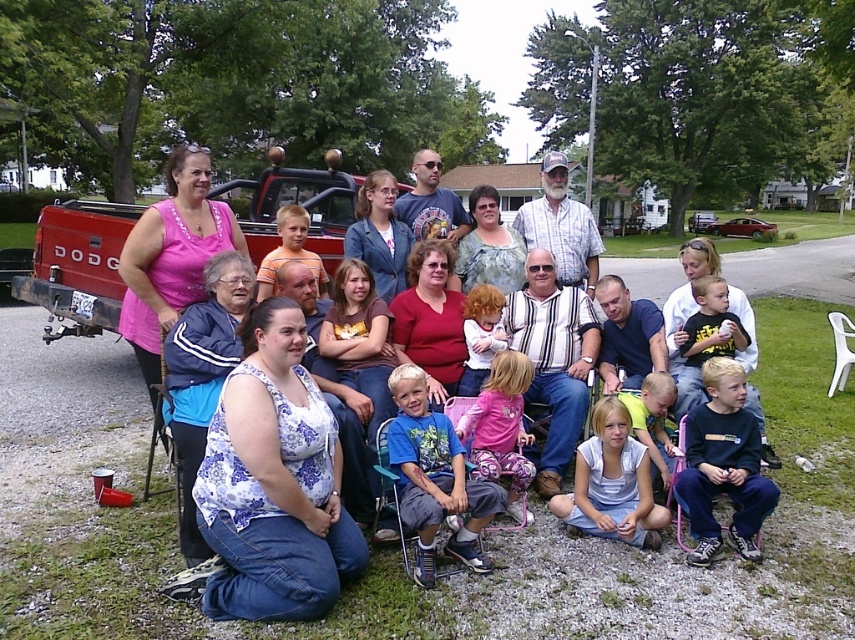
The image size is (855, 640). Describe the element at coordinates (203, 374) in the screenshot. I see `blue fabric jacket at center` at that location.

Does blue fabric jacket at center have a greater width compared to white cotton shirt at center?

Yes, blue fabric jacket at center is wider than white cotton shirt at center.

Between point (201, 440) and point (464, 324), which one is positioned behind?

Positioned behind is point (464, 324).

Where is `blue fabric jacket at center`? This screenshot has width=855, height=640. blue fabric jacket at center is located at coordinates (203, 374).

Does floral print blouse at center come behind blue cotton shirt at center?

That is False.

Is floral print blouse at center taller than blue cotton shirt at center?

Yes.

Locate an element on the screen. The height and width of the screenshot is (640, 855). floral print blouse at center is located at coordinates (274, 483).

Can you confirm if floral fabric dress at center is positioned below plaid shirt at center?

Yes.

I want to click on floral fabric dress at center, so click(x=270, y=440).

This screenshot has height=640, width=855. Identify the location of floral fabric dress at center. (270, 440).

Image resolution: width=855 pixels, height=640 pixels. Find the location of `floral fabric dress at center`. floral fabric dress at center is located at coordinates (270, 440).